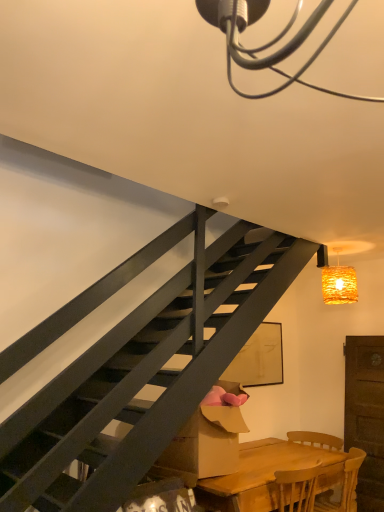
The image size is (384, 512). Find the location of `empty space that is ontop of wooden table at lower right (from a real-world perspective)`. empty space that is ontop of wooden table at lower right (from a real-world perspective) is located at coordinates (275, 456).